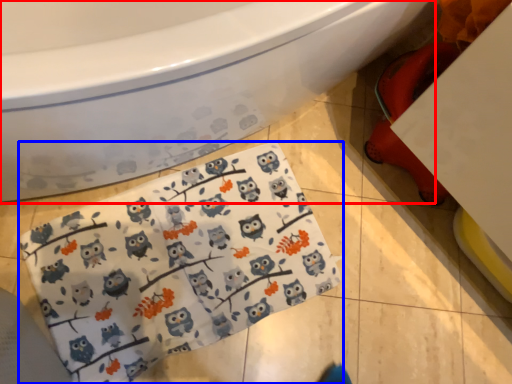
Question: Which point is closer to the camera, bathtub (highlighted by a red box) or baby clothe (highlighted by a blue box)?

Choices:
 (A) bathtub
 (B) baby clothe

Answer: (A)